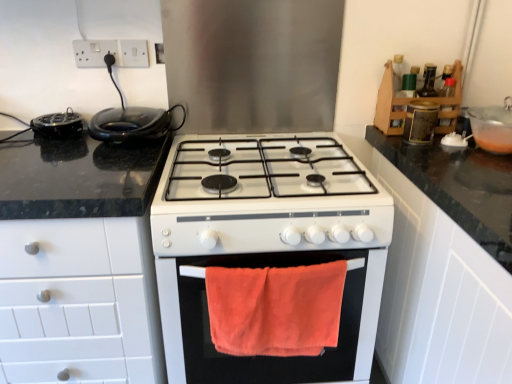
Question: From the image's perspective, is white matte cabinet at left, which ranks as the 1th cabinetry in bottom-to-top order, positioned above or below translucent plastic bowl at upper right, the 1th appliance from the right?

Choices:
 (A) above
 (B) below

Answer: (B)

Question: Based on their sizes in the image, would you say white matte cabinet at left, the second cabinetry in the top-to-bottom sequence, is bigger or smaller than translucent plastic bowl at upper right, the 1th appliance from the right?

Choices:
 (A) small
 (B) big

Answer: (B)

Question: Which is farther from the black glossy waffle iron at left?

Choices:
 (A) metallic gold canister at upper right, which is the first appliance in top-to-bottom order
 (B) white matte cabinet at left, arranged as the second cabinetry when viewed from the right
 (C) white plastic socket at upper center, the 1th electric outlet viewed from the right
 (D) white glossy stove at center, marked as the first appliance in a bottom-to-top arrangement
 (E) translucent plastic bowl at upper right, the 1th appliance from the right

Answer: (E)

Question: Which of these objects is positioned closest to the white glossy stove at center, marked as the first appliance in a bottom-to-top arrangement?

Choices:
 (A) translucent plastic bowl at upper right, marked as the fourth appliance in a left-to-right arrangement
 (B) white plastic socket at upper center, the 1th electric outlet viewed from the right
 (C) metallic gold canister at upper right, which is the 2th appliance from right to left
 (D) orange towel at center
 (E) black plastic toaster at left, which is the third appliance in bottom-to-top order

Answer: (D)